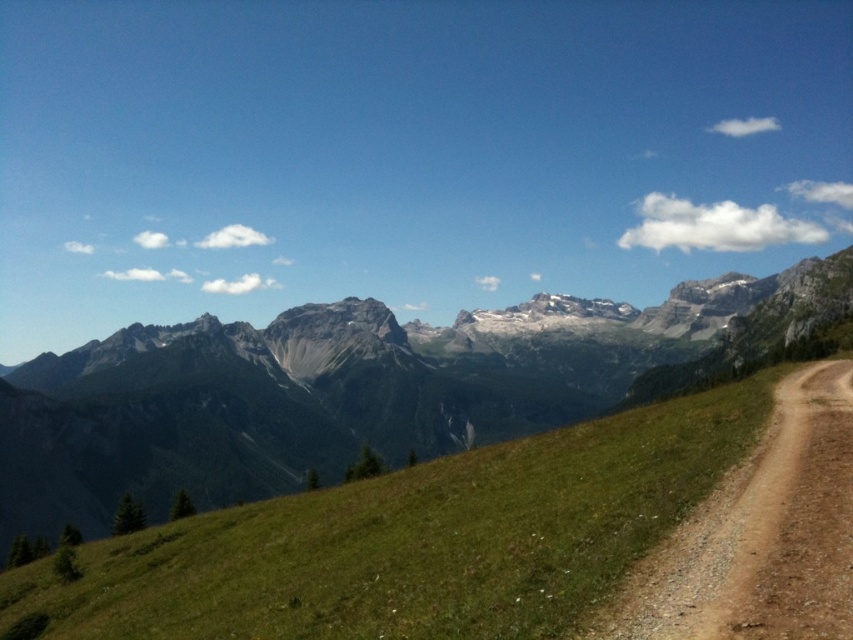
Question: Which is nearer to the gray rocky mountain range at center?

Choices:
 (A) green grassy hillside at center
 (B) brown gravel path at right

Answer: (A)

Question: Which object appears closest to the camera in this image?

Choices:
 (A) brown gravel path at right
 (B) gray rocky mountain range at center

Answer: (A)

Question: Does green grassy hillside at center have a lesser width compared to brown gravel path at right?

Choices:
 (A) no
 (B) yes

Answer: (A)

Question: Does gray rocky mountain range at center appear over green grassy hillside at center?

Choices:
 (A) yes
 (B) no

Answer: (A)

Question: In this image, where is gray rocky mountain range at center located relative to brown gravel path at right?

Choices:
 (A) right
 (B) left

Answer: (B)

Question: Among these points, which one is nearest to the camera?

Choices:
 (A) (329, 592)
 (B) (700, 548)

Answer: (B)